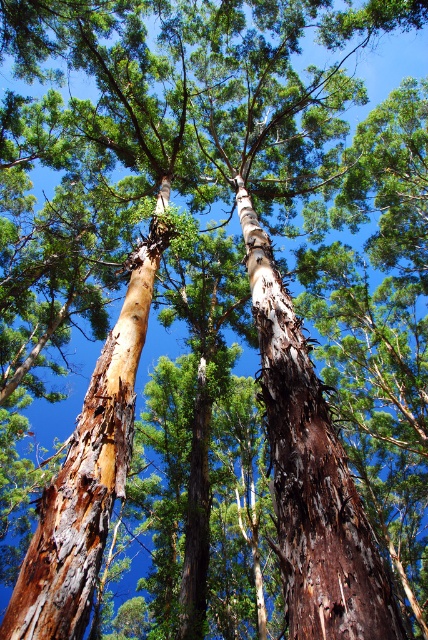
Can you confirm if brown rough bark at center is positioned to the left of brown rough bark at left?

In fact, brown rough bark at center is to the right of brown rough bark at left.

Measure the distance between brown rough bark at center and brown rough bark at left.

A distance of 5.90 feet exists between brown rough bark at center and brown rough bark at left.

The image size is (428, 640). Identify the location of brown rough bark at center. (311, 474).